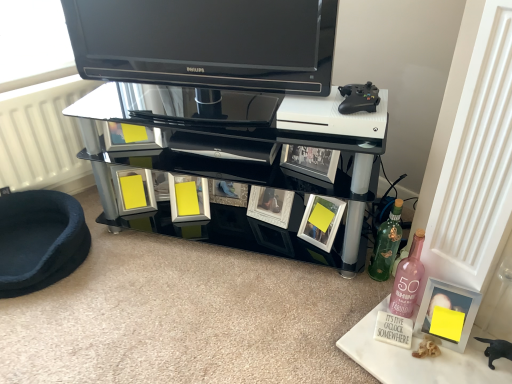
Identify the location of vacant space to the left of matte silver picture frame at lower right, which is the 2th picture frame in left-to-right order. (373, 344).